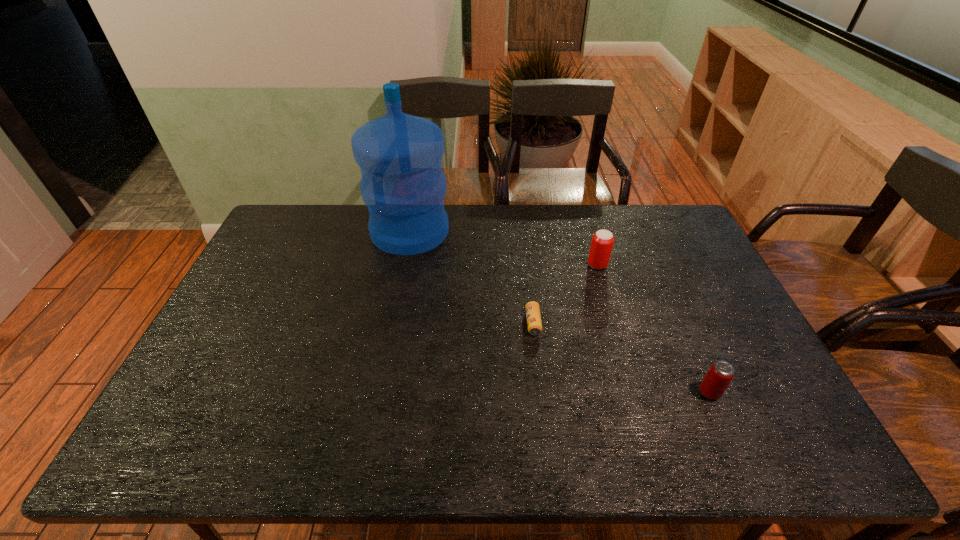
Locate which object is the third closest to the leftmost beer can. Please provide its 2D coordinates. Your answer should be formatted as a tuple, i.e. [(x, y)], where the tuple contains the x and y coordinates of a point satisfying the conditions above.

[(720, 374)]

Where is `beer can that can be found as the closest to the rightmost beer can`? beer can that can be found as the closest to the rightmost beer can is located at coordinates (534, 324).

At what (x,y) coordinates should I click in order to perform the action: click on beer can object that ranks as the closest to the tallest beer can. Please return your answer as a coordinate pair (x, y). This screenshot has width=960, height=540. Looking at the image, I should click on (x=534, y=324).

You are a GUI agent. You are given a task and a screenshot of the screen. Output one action in this format:
    pyautogui.click(x=<x>, y=<y>)
    Task: Click on the vacant position in the image that satisfies the following two spatial constraints: 1. on the front side of the shortest beer can; 2. on the right side of the nearest beer can
    
    Given the screenshot: What is the action you would take?
    pyautogui.click(x=541, y=393)

You are a GUI agent. You are given a task and a screenshot of the screen. Output one action in this format:
    pyautogui.click(x=<x>, y=<y>)
    Task: Click on the free location that satisfies the following two spatial constraints: 1. on the back side of the farthest beer can; 2. on the right side of the shortest beer can
    Image resolution: width=960 pixels, height=540 pixels.
    Given the screenshot: What is the action you would take?
    pyautogui.click(x=526, y=265)

Identify the location of vacant space that satisfies the following two spatial constraints: 1. on the front side of the farthest object; 2. on the right side of the leftmost beer can. This screenshot has width=960, height=540. (393, 323).